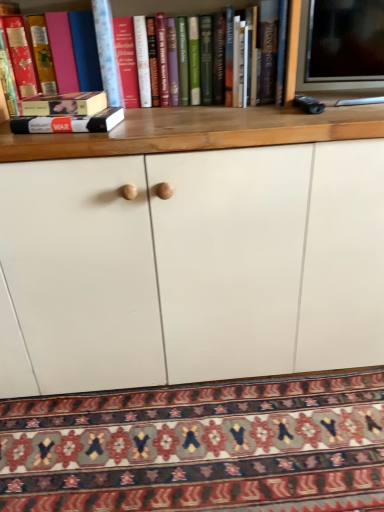
Question: Does patterned carpet at lower center appear on the left side of matte pink book at left, the 1th book in the left-to-right sequence?

Choices:
 (A) no
 (B) yes

Answer: (A)

Question: Is patterned carpet at lower center looking in the opposite direction of matte pink book at left, which is the 2th book from right to left?

Choices:
 (A) no
 (B) yes

Answer: (A)

Question: From the image's perspective, would you say patterned carpet at lower center is shown under matte pink book at left, which is counted as the 2th book, starting from the bottom?

Choices:
 (A) yes
 (B) no

Answer: (A)

Question: Can you confirm if patterned carpet at lower center is bigger than matte pink book at left, which is the 2th book from right to left?

Choices:
 (A) yes
 (B) no

Answer: (A)

Question: Is patterned carpet at lower center in front of matte pink book at left, which is the 2th book from right to left?

Choices:
 (A) no
 (B) yes

Answer: (B)

Question: Relative to patterned carpet at lower center, is hardcover book at left, which appears as the second book when viewed from the top, in front or behind?

Choices:
 (A) behind
 (B) front

Answer: (A)

Question: Is hardcover book at left, which is the second book from left to right, taller or shorter than patterned carpet at lower center?

Choices:
 (A) tall
 (B) short

Answer: (A)

Question: In terms of width, does hardcover book at left, marked as the first book in a bottom-to-top arrangement, look wider or thinner when compared to patterned carpet at lower center?

Choices:
 (A) thin
 (B) wide

Answer: (A)

Question: Considering the relative positions of hardcover book at left, marked as the first book in a bottom-to-top arrangement, and patterned carpet at lower center in the image provided, is hardcover book at left, marked as the first book in a bottom-to-top arrangement, to the left or to the right of patterned carpet at lower center?

Choices:
 (A) right
 (B) left

Answer: (B)

Question: From their relative heights in the image, would you say patterned carpet at lower center is taller or shorter than hardcover book at left, the first book viewed from the right?

Choices:
 (A) short
 (B) tall

Answer: (A)

Question: Would you say patterned carpet at lower center is to the left or to the right of hardcover book at left, the first book viewed from the right, in the picture?

Choices:
 (A) left
 (B) right

Answer: (B)

Question: Based on their sizes in the image, would you say patterned carpet at lower center is bigger or smaller than hardcover book at left, which is the second book from left to right?

Choices:
 (A) big
 (B) small

Answer: (A)

Question: Does point (326, 442) appear closer or farther from the camera than point (19, 116)?

Choices:
 (A) closer
 (B) farther

Answer: (B)

Question: From a real-world perspective, relative to matte pink book at left, which is the 2th book from right to left, is hardcover book at left, which appears as the second book when viewed from the top, vertically above or below?

Choices:
 (A) above
 (B) below

Answer: (B)

Question: Considering the positions of hardcover book at left, marked as the first book in a bottom-to-top arrangement, and matte pink book at left, arranged as the first book when viewed from the top, in the image, is hardcover book at left, marked as the first book in a bottom-to-top arrangement, taller or shorter than matte pink book at left, arranged as the first book when viewed from the top,?

Choices:
 (A) tall
 (B) short

Answer: (B)